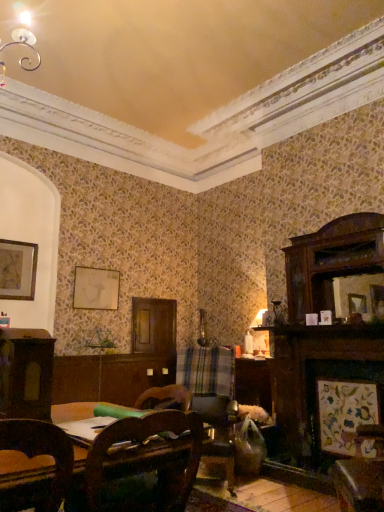
Question: Is wooden framed artwork at upper left, which is counted as the fourth picture frame, starting from the bottom, not within wooden framed artwork at lower right, positioned as the 3th picture frame in left-to-right order?

Choices:
 (A) no
 (B) yes

Answer: (B)

Question: From a real-world perspective, is wooden framed artwork at upper left, which is counted as the fourth picture frame, starting from the bottom, physically above wooden framed artwork at lower right, the 1th picture frame when ordered from bottom to top?

Choices:
 (A) yes
 (B) no

Answer: (A)

Question: Is wooden framed artwork at upper left, the 4th picture frame when ordered from right to left, shorter than wooden framed artwork at lower right, the 1th picture frame when ordered from bottom to top?

Choices:
 (A) no
 (B) yes

Answer: (B)

Question: From the image's perspective, is wooden framed artwork at upper left, the 4th picture frame when ordered from right to left, located beneath wooden framed artwork at lower right, which ranks as the 4th picture frame in back-to-front order?

Choices:
 (A) no
 (B) yes

Answer: (A)

Question: Is wooden framed artwork at lower right, the 2th picture frame from the right, completely or partially inside wooden framed artwork at upper left, which is counted as the fourth picture frame, starting from the bottom?

Choices:
 (A) no
 (B) yes

Answer: (A)

Question: Looking at their shapes, would you say plaid fabric swivel chair at center is wider or thinner than wooden framed artwork at lower right, which ranks as the 4th picture frame in back-to-front order?

Choices:
 (A) thin
 (B) wide

Answer: (B)

Question: In the image, is plaid fabric swivel chair at center positioned in front of or behind wooden framed artwork at lower right, the 1th picture frame positioned from the front?

Choices:
 (A) front
 (B) behind

Answer: (B)

Question: From a real-world perspective, is plaid fabric swivel chair at center above or below wooden framed artwork at lower right, which ranks as the 4th picture frame in back-to-front order?

Choices:
 (A) above
 (B) below

Answer: (A)

Question: In the image, is plaid fabric swivel chair at center on the left side or the right side of wooden framed artwork at lower right, the 1th picture frame when ordered from bottom to top?

Choices:
 (A) left
 (B) right

Answer: (A)

Question: Visually, is matte white picture frame at upper center, the second picture frame in the left-to-right sequence, positioned to the left or to the right of dark wood cabinet at left?

Choices:
 (A) right
 (B) left

Answer: (B)

Question: From a real-world perspective, is matte white picture frame at upper center, the third picture frame viewed from the right, above or below dark wood cabinet at left?

Choices:
 (A) below
 (B) above

Answer: (B)

Question: From the image's perspective, is matte white picture frame at upper center, which is counted as the second picture frame, starting from the top, above or below dark wood cabinet at left?

Choices:
 (A) below
 (B) above

Answer: (B)

Question: Looking at the image, does matte white picture frame at upper center, which is the fourth picture frame from front to back, seem bigger or smaller compared to dark wood cabinet at left?

Choices:
 (A) big
 (B) small

Answer: (B)

Question: From the image's perspective, relative to wooden framed artwork at lower right, which ranks as the 4th picture frame in back-to-front order, is wooden picture frame at right, the 4th picture frame from the left, above or below?

Choices:
 (A) above
 (B) below

Answer: (A)

Question: In the image, is wooden picture frame at right, placed as the first picture frame when sorted from right to left, positioned in front of or behind wooden framed artwork at lower right, arranged as the 4th picture frame when viewed from the top?

Choices:
 (A) front
 (B) behind

Answer: (B)